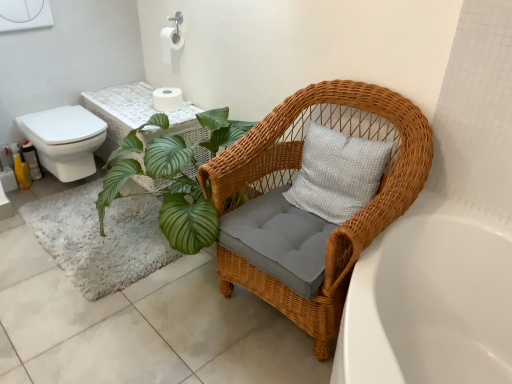
Question: From a real-world perspective, is woven wicker chair at lower right positioned above or below white matte toilet paper at upper center, positioned as the 2th toilet paper in bottom-to-top order?

Choices:
 (A) below
 (B) above

Answer: (A)

Question: Is woven wicker chair at lower right taller or shorter than white matte toilet paper at upper center, which is the 1th toilet paper in top-to-bottom order?

Choices:
 (A) tall
 (B) short

Answer: (A)

Question: Based on their relative distances, which object is nearer to the woven wicker chair at lower right?

Choices:
 (A) white glossy toilet at left
 (B) white matte toilet paper at upper center, which is the 1th toilet paper in top-to-bottom order
 (C) white ceramic bathtub at lower right
 (D) white matte toilet paper at upper center, the 1th toilet paper positioned from the bottom

Answer: (C)

Question: Considering the real-world distances, which object is farthest from the white ceramic bathtub at lower right?

Choices:
 (A) white matte toilet paper at upper center, the 1th toilet paper positioned from the bottom
 (B) white glossy toilet at left
 (C) white matte toilet paper at upper center, which is the 1th toilet paper in top-to-bottom order
 (D) woven wicker chair at lower right

Answer: (C)